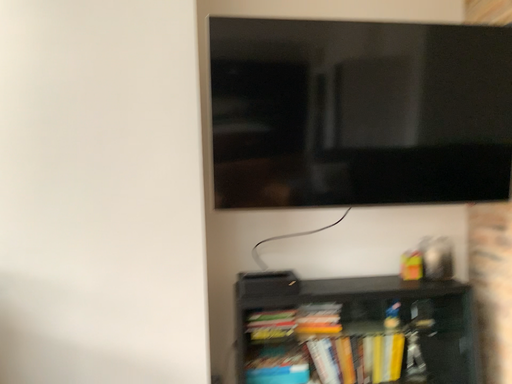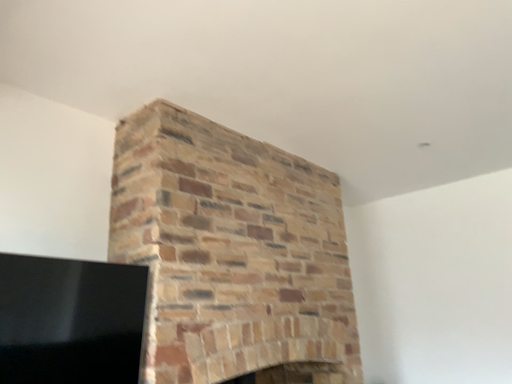
Question: How did the camera likely rotate when shooting the video?

Choices:
 (A) rotated left
 (B) rotated right

Answer: (B)